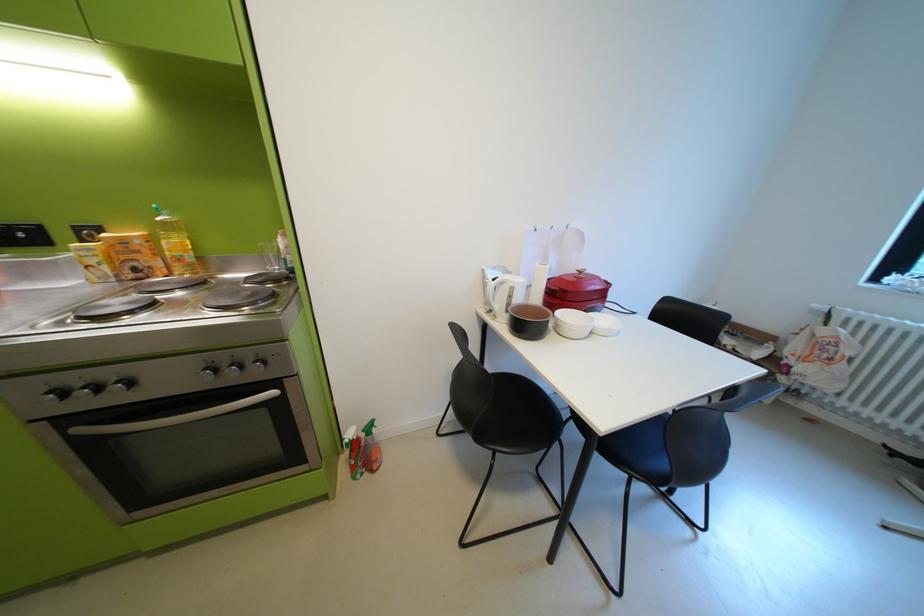
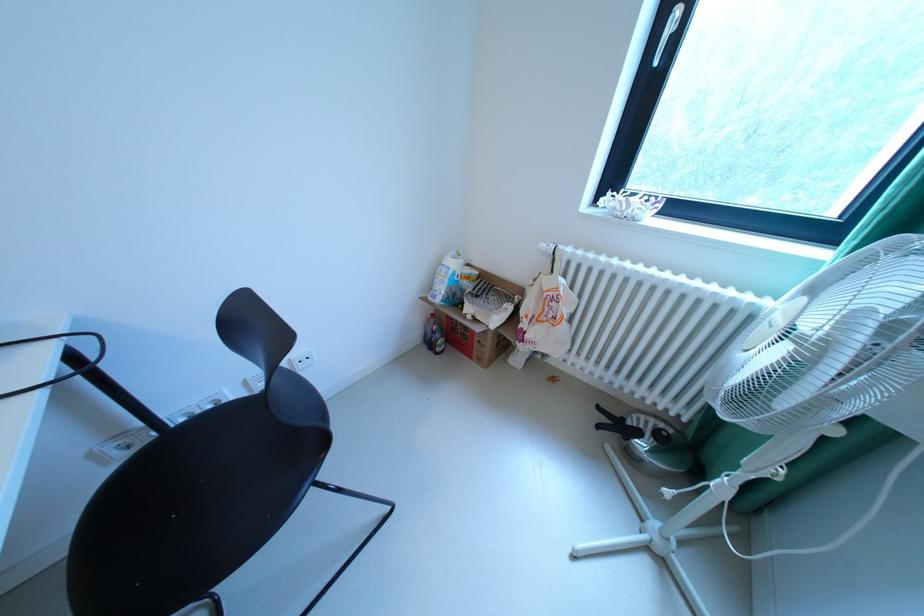
Find the pixel in the second image that matches [825,306] in the first image.

(553, 246)